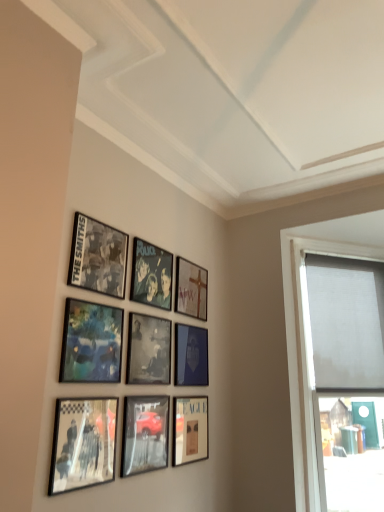
Question: Which direction should I rotate to look at metallic reflective car at lower center, the 2th picture frame from the bottom, — up or down?

Choices:
 (A) up
 (B) down

Answer: (B)

Question: Is metallic reflective car at lower center, acting as the 8th picture frame starting from the top, to the left of matte blue painting at center-left, the 4th picture frame positioned from the top, from the viewer's perspective?

Choices:
 (A) yes
 (B) no

Answer: (B)

Question: Is metallic reflective car at lower center, the 2th picture frame from the bottom, wider than matte blue painting at center-left, the 4th picture frame positioned from the top?

Choices:
 (A) yes
 (B) no

Answer: (B)

Question: From the image's perspective, is metallic reflective car at lower center, the 2th picture frame from the bottom, on top of matte blue painting at center-left, the 6th picture frame ordered from the bottom?

Choices:
 (A) yes
 (B) no

Answer: (B)

Question: Does metallic reflective car at lower center, the 2th picture frame from the bottom, have a greater height compared to matte blue painting at center-left, the 4th picture frame positioned from the top?

Choices:
 (A) yes
 (B) no

Answer: (B)

Question: From the image's perspective, does metallic reflective car at lower center, acting as the 8th picture frame starting from the top, appear lower than matte blue painting at center-left, the 4th picture frame positioned from the top?

Choices:
 (A) no
 (B) yes

Answer: (B)

Question: Is metallic reflective car at lower center, acting as the 8th picture frame starting from the top, positioned beyond the bounds of matte blue painting at center-left, the 4th picture frame positioned from the top?

Choices:
 (A) no
 (B) yes

Answer: (B)

Question: Is black matte picture frame at center, acting as the fifth picture frame starting from the top, thinner than matte black picture frame at lower center, positioned as the ninth picture frame in top-to-bottom order?

Choices:
 (A) no
 (B) yes

Answer: (A)

Question: Is black matte picture frame at center, acting as the fifth picture frame starting from the top, positioned far away from matte black picture frame at lower center, marked as the first picture frame in a bottom-to-top arrangement?

Choices:
 (A) yes
 (B) no

Answer: (B)

Question: Can you confirm if black matte picture frame at center, the 5th picture frame from the bottom, is smaller than matte black picture frame at lower center, marked as the first picture frame in a bottom-to-top arrangement?

Choices:
 (A) no
 (B) yes

Answer: (A)

Question: From a real-world perspective, is black matte picture frame at center, the 5th picture frame from the bottom, on matte black picture frame at lower center, positioned as the ninth picture frame in top-to-bottom order?

Choices:
 (A) yes
 (B) no

Answer: (A)

Question: Is black matte picture frame at center, the 5th picture frame from the bottom, located outside matte black picture frame at lower center, positioned as the ninth picture frame in top-to-bottom order?

Choices:
 (A) yes
 (B) no

Answer: (A)

Question: Is black matte picture frame at center, the 5th picture frame from the bottom, shorter than matte black picture frame at lower center, marked as the first picture frame in a bottom-to-top arrangement?

Choices:
 (A) no
 (B) yes

Answer: (B)

Question: Does metallic silver photo frame at center, which appears as the 8th picture frame when ordered from the bottom, turn towards metallic reflective car at lower center, acting as the 8th picture frame starting from the top?

Choices:
 (A) yes
 (B) no

Answer: (B)